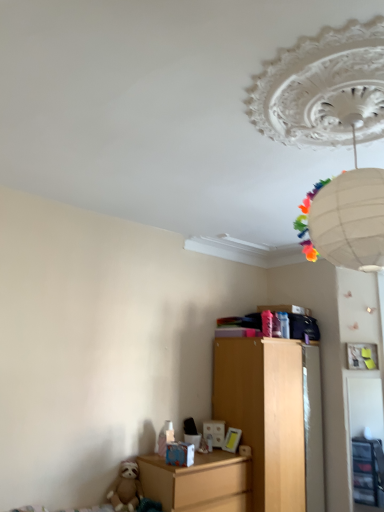
Question: Is brown plush sloth at lower left next to matte wooden nightstand at lower left?

Choices:
 (A) yes
 (B) no

Answer: (B)

Question: Considering the relative positions of brown plush sloth at lower left and matte wooden nightstand at lower left in the image provided, is brown plush sloth at lower left to the right of matte wooden nightstand at lower left from the viewer's perspective?

Choices:
 (A) no
 (B) yes

Answer: (A)

Question: From a real-world perspective, does brown plush sloth at lower left sit lower than matte wooden nightstand at lower left?

Choices:
 (A) no
 (B) yes

Answer: (A)

Question: Is brown plush sloth at lower left not near matte wooden nightstand at lower left?

Choices:
 (A) no
 (B) yes

Answer: (A)

Question: Does brown plush sloth at lower left appear on the left side of matte wooden nightstand at lower left?

Choices:
 (A) no
 (B) yes

Answer: (B)

Question: Does point (301, 502) appear closer or farther from the camera than point (110, 501)?

Choices:
 (A) farther
 (B) closer

Answer: (A)

Question: From their relative heights in the image, would you say wooden chest of drawers at center is taller or shorter than brown plush sloth at lower left?

Choices:
 (A) tall
 (B) short

Answer: (A)

Question: From a real-world perspective, relative to brown plush sloth at lower left, is wooden chest of drawers at center vertically above or below?

Choices:
 (A) above
 (B) below

Answer: (A)

Question: In the image, is wooden chest of drawers at center on the left side or the right side of brown plush sloth at lower left?

Choices:
 (A) left
 (B) right

Answer: (B)

Question: From a real-world perspective, is matte wooden nightstand at lower left physically located above or below white paper lantern at upper center?

Choices:
 (A) below
 (B) above

Answer: (A)

Question: In the image, is matte wooden nightstand at lower left positioned in front of or behind white paper lantern at upper center?

Choices:
 (A) behind
 (B) front

Answer: (A)

Question: In terms of width, does matte wooden nightstand at lower left look wider or thinner when compared to white paper lantern at upper center?

Choices:
 (A) wide
 (B) thin

Answer: (B)

Question: Based on their sizes in the image, would you say matte wooden nightstand at lower left is bigger or smaller than white paper lantern at upper center?

Choices:
 (A) big
 (B) small

Answer: (B)

Question: Considering the positions of wooden chest of drawers at center and matte wooden nightstand at lower left in the image, is wooden chest of drawers at center bigger or smaller than matte wooden nightstand at lower left?

Choices:
 (A) small
 (B) big

Answer: (B)

Question: From the image's perspective, is wooden chest of drawers at center located above or below matte wooden nightstand at lower left?

Choices:
 (A) above
 (B) below

Answer: (A)